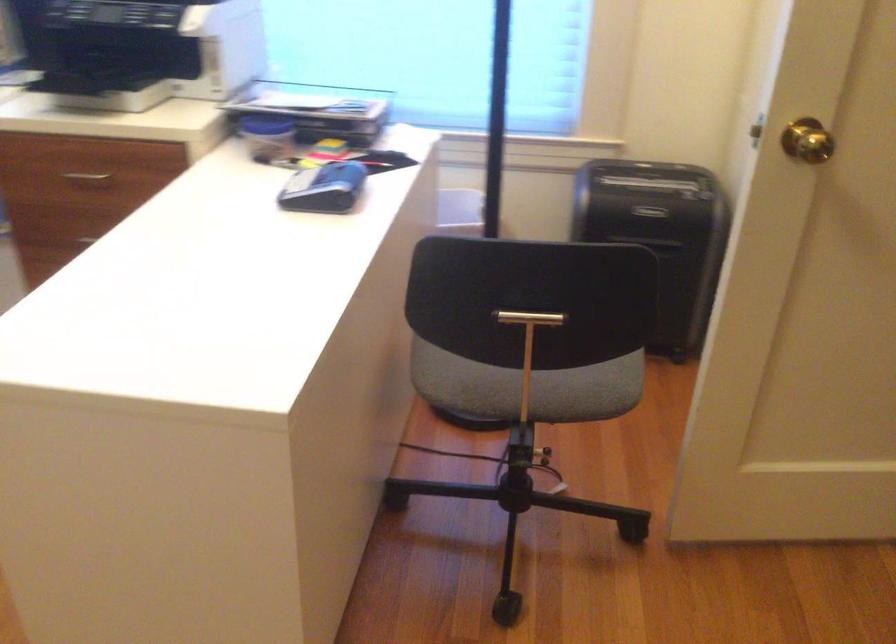
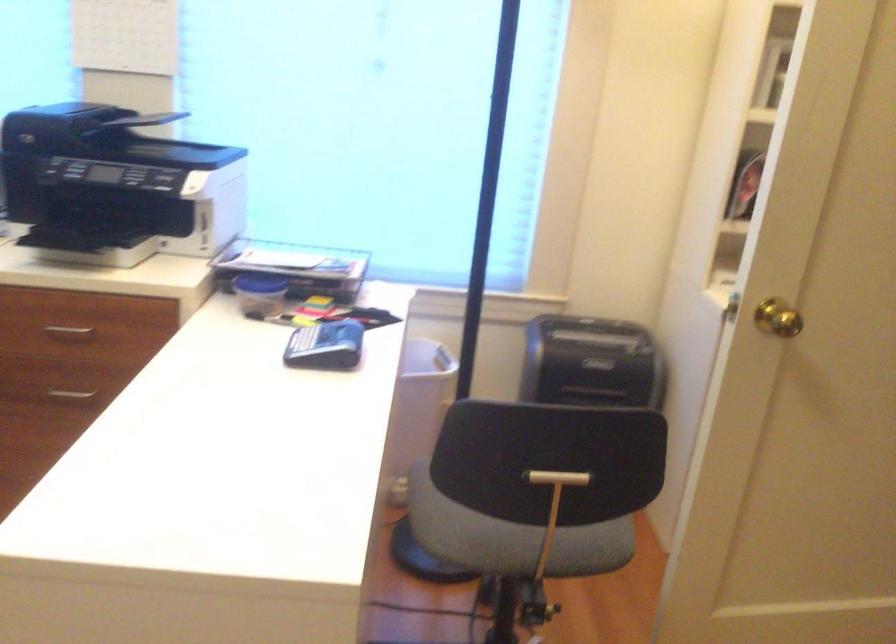
In the second image, find the point that corresponds to [514,341] in the first image.

(535, 495)